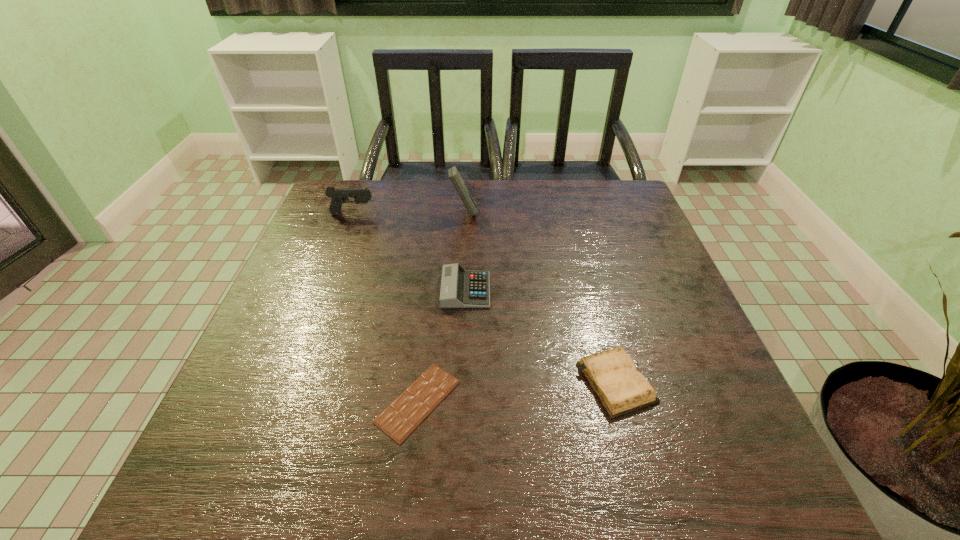
I want to click on the taller calculator, so click(456, 179).

Locate an element on the screen. The width and height of the screenshot is (960, 540). the tallest object is located at coordinates (456, 179).

Identify the location of the leftmost object. The width and height of the screenshot is (960, 540). click(x=338, y=196).

The image size is (960, 540). Identify the location of the second tallest object. (338, 196).

Identify the location of the third farthest object. Image resolution: width=960 pixels, height=540 pixels. (460, 288).

Find the location of a particular element. Image resolution: width=960 pixels, height=540 pixels. the third shortest object is located at coordinates (460, 288).

Find the location of a particular element. The height and width of the screenshot is (540, 960). the second shortest object is located at coordinates (613, 376).

Find the location of `the rightmost object`. the rightmost object is located at coordinates (613, 376).

I want to click on chocolate bar, so click(x=403, y=415).

Where is `vacant area situated 0.280m on the front-facing side of the farther calculator`? vacant area situated 0.280m on the front-facing side of the farther calculator is located at coordinates (576, 213).